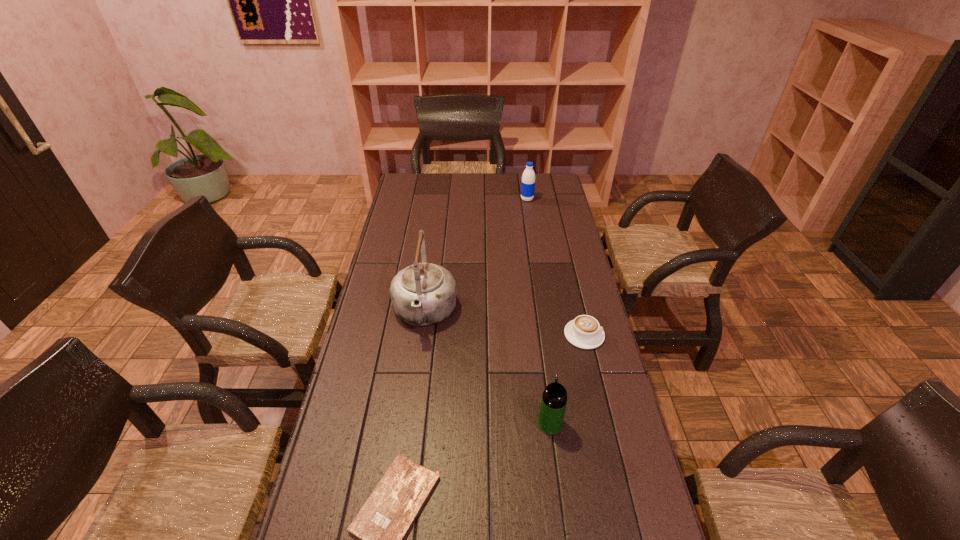
Find the location of a particular element. Image resolution: width=960 pixels, height=540 pixels. kettle is located at coordinates (423, 294).

Image resolution: width=960 pixels, height=540 pixels. In order to click on the farthest object in this screenshot , I will do `click(528, 178)`.

This screenshot has height=540, width=960. What are the coordinates of `thermos bottle` in the screenshot? It's located at click(554, 398).

I want to click on cappuccino, so [585, 332].

You are a GUI agent. You are given a task and a screenshot of the screen. Output one action in this format:
    pyautogui.click(x=<x>, y=<y>)
    Task: Click on the fourth tallest object
    This screenshot has width=960, height=540.
    Given the screenshot: What is the action you would take?
    pyautogui.click(x=585, y=332)

Locate an element on the screen. This screenshot has height=540, width=960. vacant space located 0.290m at the spout of the tallest object is located at coordinates (410, 423).

Image resolution: width=960 pixels, height=540 pixels. I want to click on blank space located 0.050m on the back of the farthest object, so click(526, 191).

Image resolution: width=960 pixels, height=540 pixels. Identify the location of vacant space located 0.210m from the spout of the thermos bottle. (540, 354).

At what (x,y) coordinates should I click in order to perform the action: click on free location located 0.310m from the spout of the thermos bottle. Please return your answer as a coordinate pair (x, y). Looking at the image, I should click on (538, 330).

Image resolution: width=960 pixels, height=540 pixels. Find the location of `free region located from the spout of the thermos bottle`. free region located from the spout of the thermos bottle is located at coordinates click(541, 362).